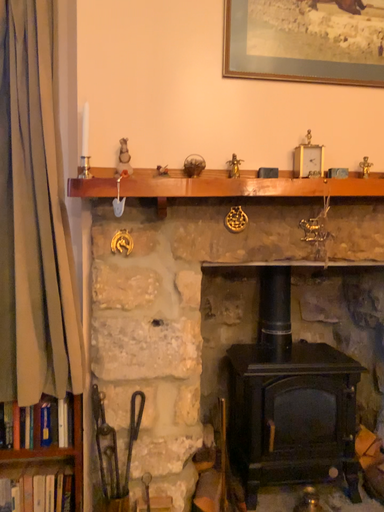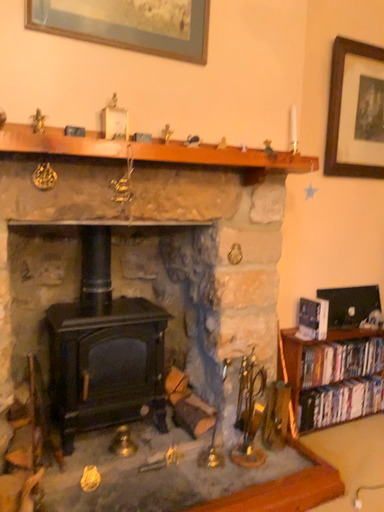
Question: How did the camera likely rotate when shooting the video?

Choices:
 (A) rotated left
 (B) rotated right

Answer: (B)